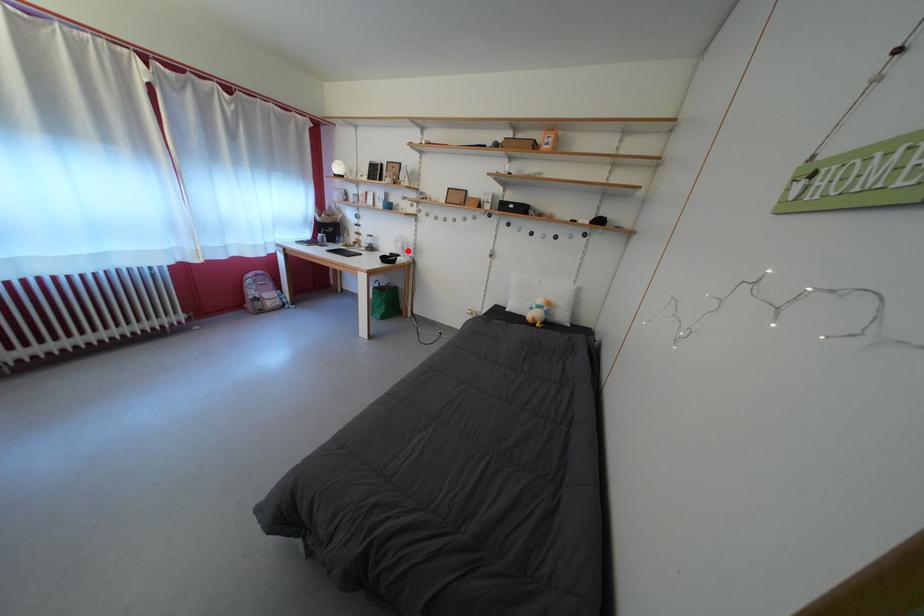
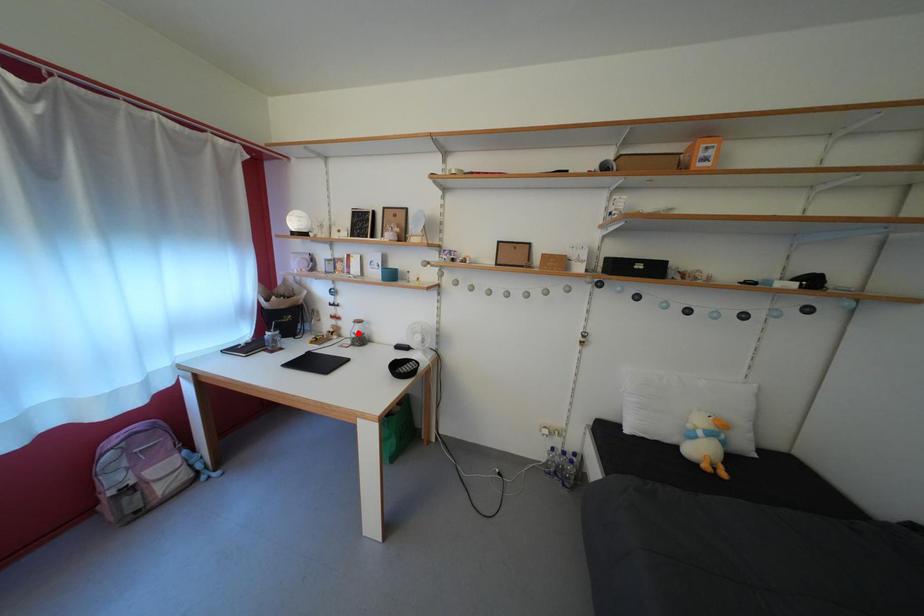
I am providing you with two images of the same scene from different viewpoints. A red point is marked on the first image and another point is marked on the second image. Are the points marked in image1 and image2 representing the same 3D position?

No